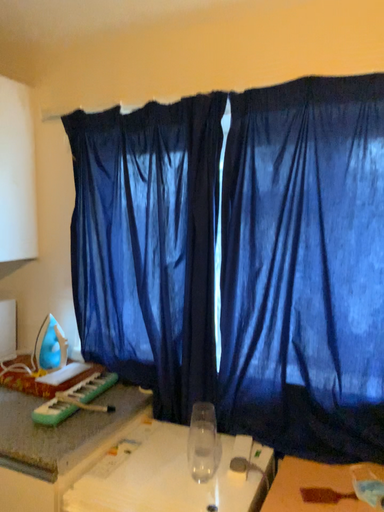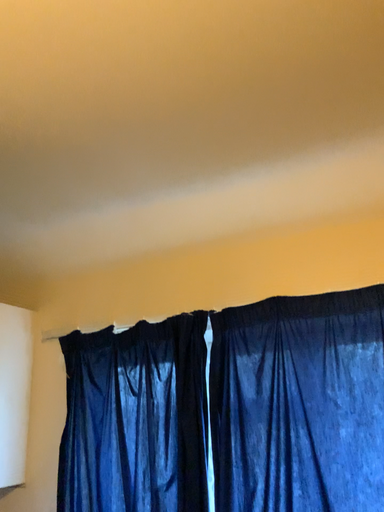
Question: Which way did the camera rotate in the video?

Choices:
 (A) rotated downward
 (B) rotated upward

Answer: (B)